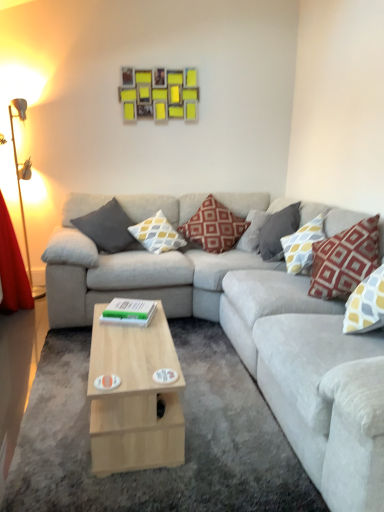
At what (x,y) coordinates should I click in order to perform the action: click on vacant region to the left of light wood/wooden coffee table at center. Please return your answer as a coordinate pair (x, y). Image resolution: width=384 pixels, height=512 pixels. Looking at the image, I should click on (58, 402).